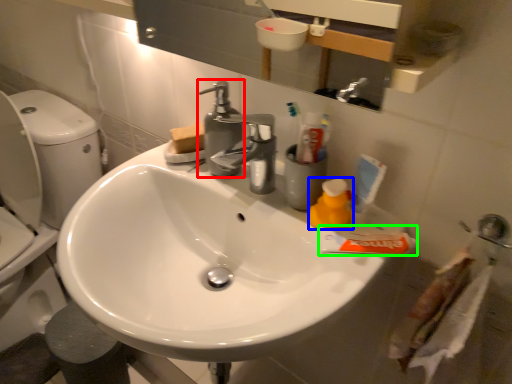
Question: Based on their relative distances, which object is nearer to plumbing fixture (highlighted by a red box)? Choose from cleaning product (highlighted by a blue box) and toothpaste (highlighted by a green box).

Choices:
 (A) cleaning product
 (B) toothpaste

Answer: (A)